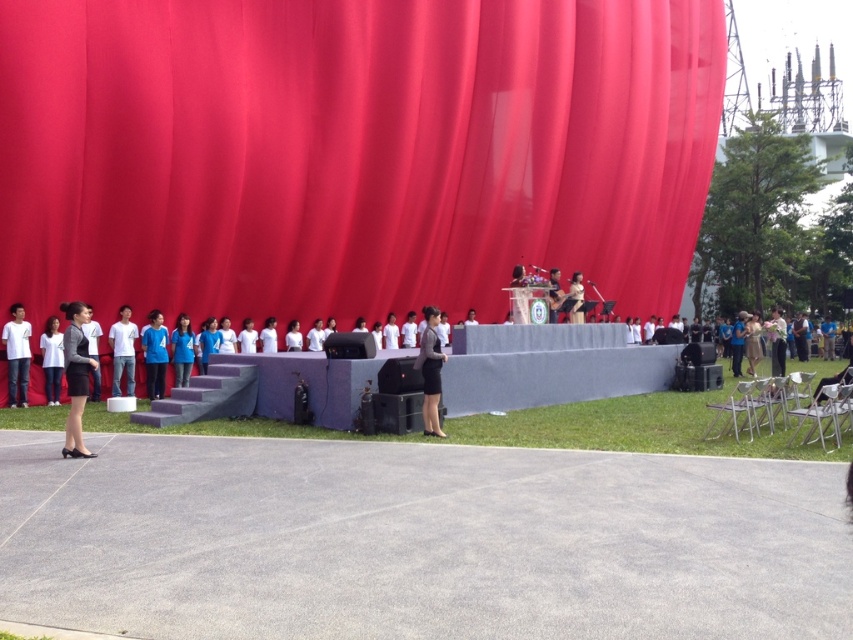
Question: Can you confirm if matte red curtain at upper center is smaller than white matte shirt at center?

Choices:
 (A) yes
 (B) no

Answer: (B)

Question: Which object is the closest to the white matte shirt at center?

Choices:
 (A) white cotton shirt at left
 (B) matte red curtain at upper center
 (C) brown fabric at right

Answer: (A)

Question: Can you confirm if white cotton shirt at left is positioned to the left of brown fabric at right?

Choices:
 (A) no
 (B) yes

Answer: (B)

Question: Can you confirm if white cotton shirt at left is wider than white matte shirt at center?

Choices:
 (A) yes
 (B) no

Answer: (B)

Question: Which of the following is the closest to the observer?

Choices:
 (A) white cotton shirt at left
 (B) brown fabric at right
 (C) white matte shirt at center

Answer: (A)

Question: Which point appears closest to the camera in this image?

Choices:
 (A) (119, 369)
 (B) (180, 307)

Answer: (A)